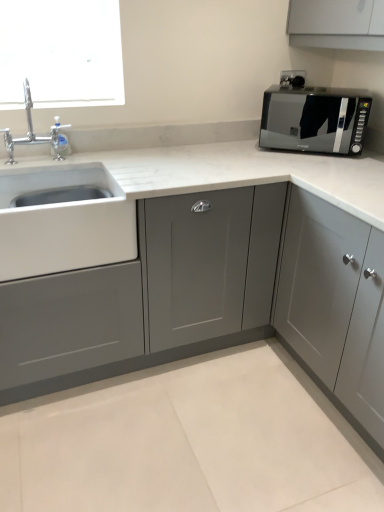
Question: Is chrome metallic faucet at upper left oriented away from matte gray cabinet at center, placed as the first cabinetry when sorted from left to right?

Choices:
 (A) yes
 (B) no

Answer: (B)

Question: From the image's perspective, is chrome metallic faucet at upper left on matte gray cabinet at center, placed as the first cabinetry when sorted from left to right?

Choices:
 (A) no
 (B) yes

Answer: (B)

Question: From a real-world perspective, does chrome metallic faucet at upper left sit lower than matte gray cabinet at center, placed as the first cabinetry when sorted from left to right?

Choices:
 (A) no
 (B) yes

Answer: (A)

Question: From a real-world perspective, is chrome metallic faucet at upper left located higher than matte gray cabinet at center, acting as the second cabinetry starting from the right?

Choices:
 (A) no
 (B) yes

Answer: (B)

Question: Is chrome metallic faucet at upper left not within matte gray cabinet at center, placed as the first cabinetry when sorted from left to right?

Choices:
 (A) no
 (B) yes

Answer: (B)

Question: Does chrome metallic faucet at upper left come behind matte gray cabinet at center, placed as the first cabinetry when sorted from left to right?

Choices:
 (A) no
 (B) yes

Answer: (B)

Question: From the image's perspective, does matte gray cabinet at center, acting as the second cabinetry starting from the right, appear lower than black glossy microwave at upper right?

Choices:
 (A) yes
 (B) no

Answer: (A)

Question: Is matte gray cabinet at center, acting as the second cabinetry starting from the right, at the left side of black glossy microwave at upper right?

Choices:
 (A) yes
 (B) no

Answer: (A)

Question: Can we say matte gray cabinet at center, acting as the second cabinetry starting from the right, lies outside black glossy microwave at upper right?

Choices:
 (A) yes
 (B) no

Answer: (A)

Question: Considering the relative sizes of matte gray cabinet at center, placed as the first cabinetry when sorted from left to right, and black glossy microwave at upper right in the image provided, is matte gray cabinet at center, placed as the first cabinetry when sorted from left to right, thinner than black glossy microwave at upper right?

Choices:
 (A) yes
 (B) no

Answer: (B)

Question: Does matte gray cabinet at center, placed as the first cabinetry when sorted from left to right, turn towards black glossy microwave at upper right?

Choices:
 (A) yes
 (B) no

Answer: (B)

Question: From the image's perspective, would you say matte gray cabinet at center, acting as the second cabinetry starting from the right, is positioned over black glossy microwave at upper right?

Choices:
 (A) yes
 (B) no

Answer: (B)

Question: Is black glossy microwave at upper right to the right of matte gray cabinet at center, placed as the first cabinetry when sorted from left to right, from the viewer's perspective?

Choices:
 (A) yes
 (B) no

Answer: (A)